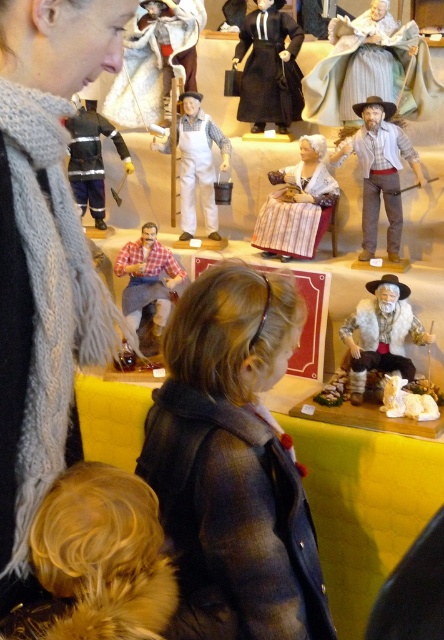
Question: Can you confirm if knitted gray scarf at upper left is thinner than matte gray figure at upper center?

Choices:
 (A) no
 (B) yes

Answer: (B)

Question: Among these points, which one is nearest to the camera?

Choices:
 (A) (162, 401)
 (B) (182, 186)

Answer: (A)

Question: Among these objects, which one is farthest from the camera?

Choices:
 (A) knitted gray scarf at upper left
 (B) fuzzy yellow wig at lower left
 (C) white matte overalls at center

Answer: (C)

Question: Does flannel shirt at center have a smaller size compared to matte brown fabric doll at center?

Choices:
 (A) no
 (B) yes

Answer: (A)

Question: Can you confirm if matte gray figure at upper center is positioned to the left of matte black dress at center?

Choices:
 (A) no
 (B) yes

Answer: (A)

Question: Which of the following is the closest to the observer?

Choices:
 (A) matte brown fabric doll at center
 (B) fuzzy yellow wig at lower left
 (C) fuzzy white beard at center

Answer: (B)